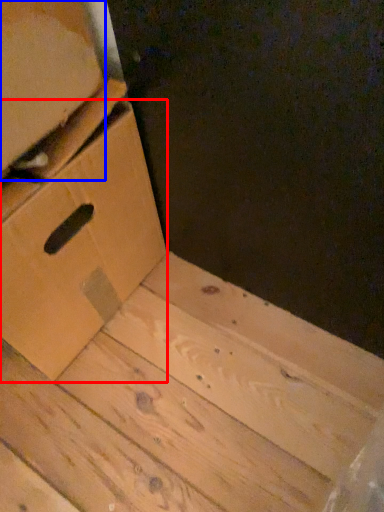
Question: Which object is further to the camera taking this photo, drawer (highlighted by a red box) or cardboard box (highlighted by a blue box)?

Choices:
 (A) drawer
 (B) cardboard box

Answer: (A)